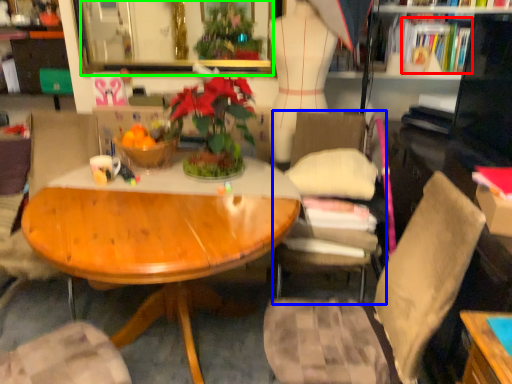
Question: Based on their relative distances, which object is farther from book (highlighted by a red box)? Choose from chair (highlighted by a blue box) and mirror (highlighted by a green box).

Choices:
 (A) chair
 (B) mirror

Answer: (B)